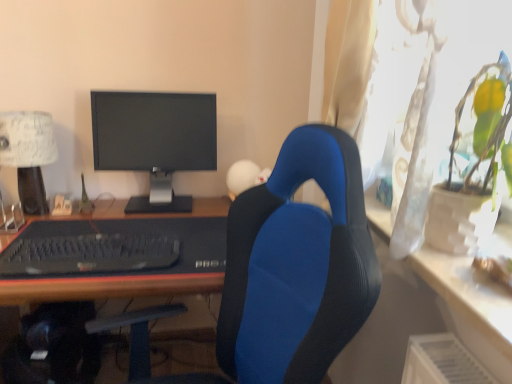
Question: Can you confirm if black rubberized desk at center is shorter than blue fabric chair at center?

Choices:
 (A) yes
 (B) no

Answer: (A)

Question: Is black rubberized desk at center not close to blue fabric chair at center?

Choices:
 (A) yes
 (B) no

Answer: (B)

Question: Is black rubberized desk at center thinner than blue fabric chair at center?

Choices:
 (A) no
 (B) yes

Answer: (A)

Question: Is blue fabric chair at center a part of black rubberized desk at center?

Choices:
 (A) yes
 (B) no

Answer: (B)

Question: From the image's perspective, would you say black rubberized desk at center is positioned over blue fabric chair at center?

Choices:
 (A) no
 (B) yes

Answer: (A)

Question: Is black matte keyboard at lower left bigger or smaller than blue fabric chair at center?

Choices:
 (A) small
 (B) big

Answer: (A)

Question: Considering the positions of black matte keyboard at lower left and blue fabric chair at center in the image, is black matte keyboard at lower left wider or thinner than blue fabric chair at center?

Choices:
 (A) wide
 (B) thin

Answer: (B)

Question: Which is correct: black matte keyboard at lower left is inside blue fabric chair at center, or outside of it?

Choices:
 (A) inside
 (B) outside

Answer: (B)

Question: Is point (138, 256) positioned closer to the camera than point (330, 334)?

Choices:
 (A) closer
 (B) farther

Answer: (B)

Question: Considering the positions of blue fabric chair at center and black matte keyboard at lower left in the image, is blue fabric chair at center taller or shorter than black matte keyboard at lower left?

Choices:
 (A) tall
 (B) short

Answer: (A)

Question: From the image's perspective, is blue fabric chair at center positioned above or below black matte keyboard at lower left?

Choices:
 (A) above
 (B) below

Answer: (B)

Question: Considering the positions of point (323, 314) and point (86, 271), is point (323, 314) closer or farther from the camera than point (86, 271)?

Choices:
 (A) farther
 (B) closer

Answer: (B)

Question: Visually, is blue fabric chair at center positioned to the left or to the right of black matte keyboard at lower left?

Choices:
 (A) right
 (B) left

Answer: (A)

Question: From a real-world perspective, relative to black rubberized desk at center, is matte black monitor at center vertically above or below?

Choices:
 (A) above
 (B) below

Answer: (A)

Question: Looking at the image, does matte black monitor at center seem bigger or smaller compared to black rubberized desk at center?

Choices:
 (A) big
 (B) small

Answer: (B)